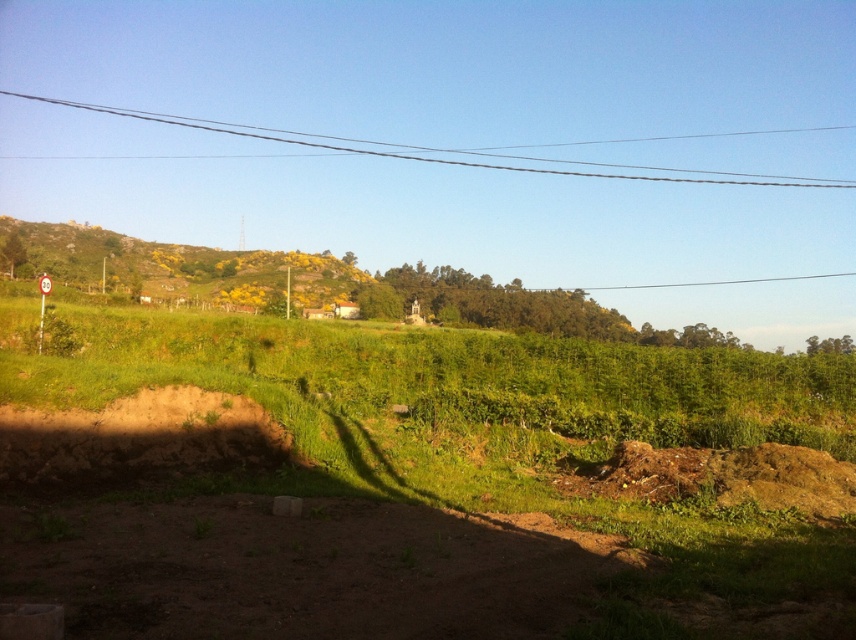
You are standing in the rural landscape and want to walk from the point closer to you to the point further away. Which path would you take between the two points, point (x=131, y=268) and point (x=437, y=154)?

You should walk from point (x=131, y=268) to point (x=437, y=154) because point (x=131, y=268) is closer to the viewer and the other point is further away.

You are a hiker trying to navigate through the rural landscape. You see a brown dirt track at lower center and a clear wire at upper center. Which one is closer to the ground?

The brown dirt track at lower center is closer to the ground because it is not as tall as the clear wire at upper center.